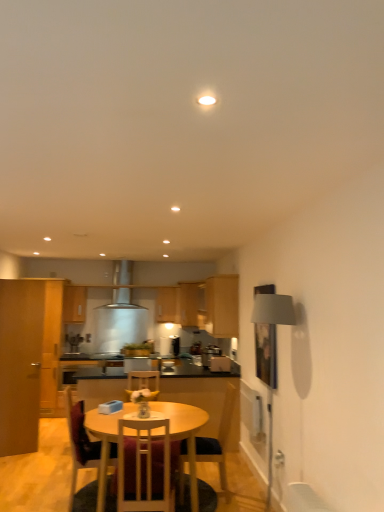
Question: Considering the relative sizes of wooden chair at center, which ranks as the 3th chair in front-to-back order, and metallic silver toaster at center, the 1th appliance in the right-to-left sequence, in the image provided, is wooden chair at center, which ranks as the 3th chair in front-to-back order, taller than metallic silver toaster at center, the 1th appliance in the right-to-left sequence,?

Choices:
 (A) yes
 (B) no

Answer: (A)

Question: Is wooden chair at center, which is counted as the 2th chair, starting from the back, oriented away from metallic silver toaster at center, the first appliance when ordered from front to back?

Choices:
 (A) no
 (B) yes

Answer: (A)

Question: Is wooden chair at center, which ranks as the 3th chair in front-to-back order, outside of metallic silver toaster at center, acting as the 3th appliance starting from the back?

Choices:
 (A) no
 (B) yes

Answer: (B)

Question: From a real-world perspective, is wooden chair at center, which is counted as the 2th chair, starting from the back, under metallic silver toaster at center, acting as the 3th appliance starting from the back?

Choices:
 (A) no
 (B) yes

Answer: (B)

Question: Is wooden chair at center, which ranks as the 3th chair in front-to-back order, far from metallic silver toaster at center, the 1th appliance in the right-to-left sequence?

Choices:
 (A) no
 (B) yes

Answer: (B)

Question: Does wooden chair at center, which is counted as the 2th chair, starting from the back, appear on the left side of metallic silver toaster at center, acting as the 3th appliance starting from the back?

Choices:
 (A) no
 (B) yes

Answer: (B)

Question: Is wooden chair at center, which ranks as the 3th chair in front-to-back order, closer to camera compared to white wood chair at center, positioned as the 4th chair in back-to-front order?

Choices:
 (A) no
 (B) yes

Answer: (A)

Question: From the image's perspective, is wooden chair at center, which ranks as the 3th chair in front-to-back order, on top of white wood chair at center, positioned as the first chair in front-to-back order?

Choices:
 (A) yes
 (B) no

Answer: (B)

Question: Is wooden chair at center, which ranks as the 3th chair in front-to-back order, not within white wood chair at center, positioned as the first chair in front-to-back order?

Choices:
 (A) yes
 (B) no

Answer: (A)

Question: Is the surface of wooden chair at center, which is counted as the 2th chair, starting from the back, in direct contact with white wood chair at center, positioned as the first chair in front-to-back order?

Choices:
 (A) yes
 (B) no

Answer: (B)

Question: Is wooden chair at center, which is counted as the 2th chair, starting from the back, thinner than white wood chair at center, positioned as the first chair in front-to-back order?

Choices:
 (A) yes
 (B) no

Answer: (B)

Question: From the image's perspective, is wooden chair at center, which ranks as the 3th chair in front-to-back order, beneath white wood chair at center, positioned as the 4th chair in back-to-front order?

Choices:
 (A) no
 (B) yes

Answer: (B)

Question: From a real-world perspective, is wooden chair at center, which ranks as the 3th chair in front-to-back order, on top of wooden round table at center?

Choices:
 (A) no
 (B) yes

Answer: (B)